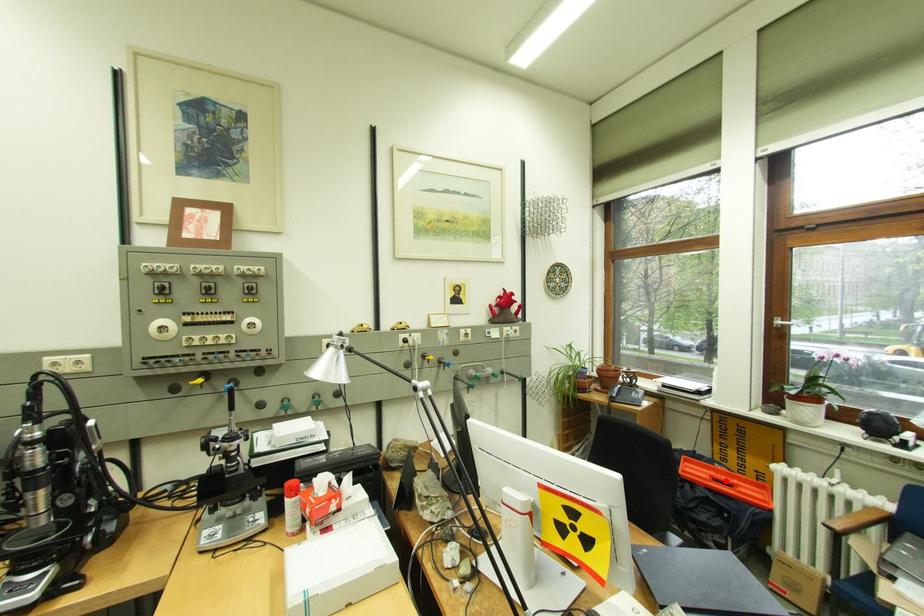
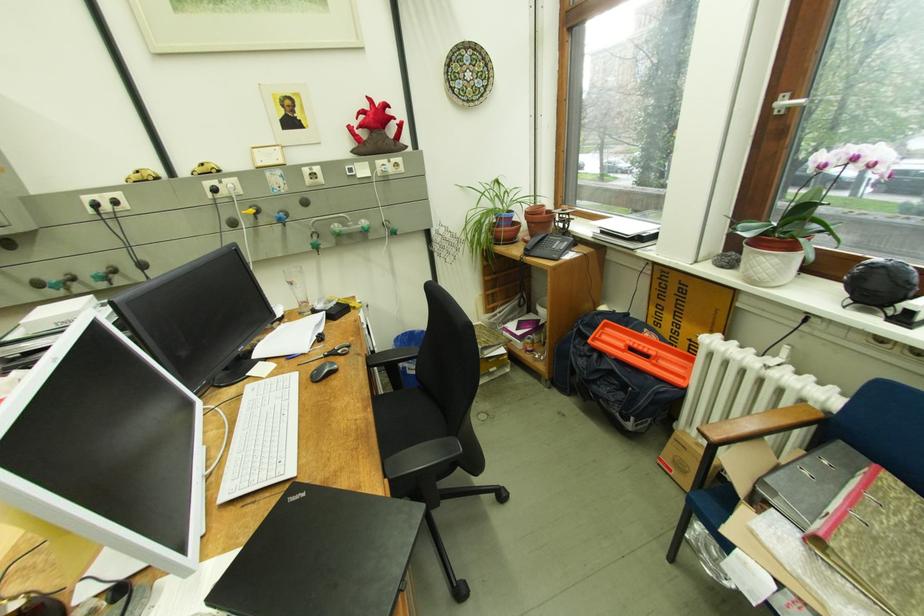
Find the pixel in the second image that matches the highlighted location in the first image.

(641, 351)